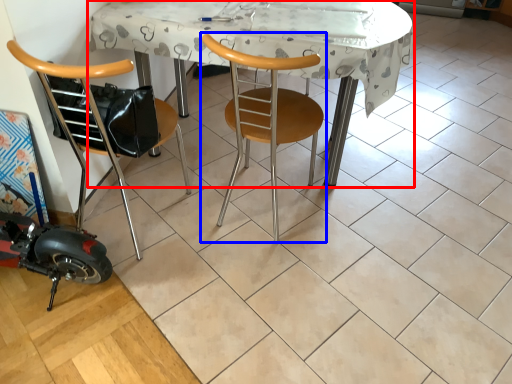
Question: Among these objects, which one is nearest to the camera, table (highlighted by a red box) or chair (highlighted by a blue box)?

Choices:
 (A) table
 (B) chair

Answer: (B)